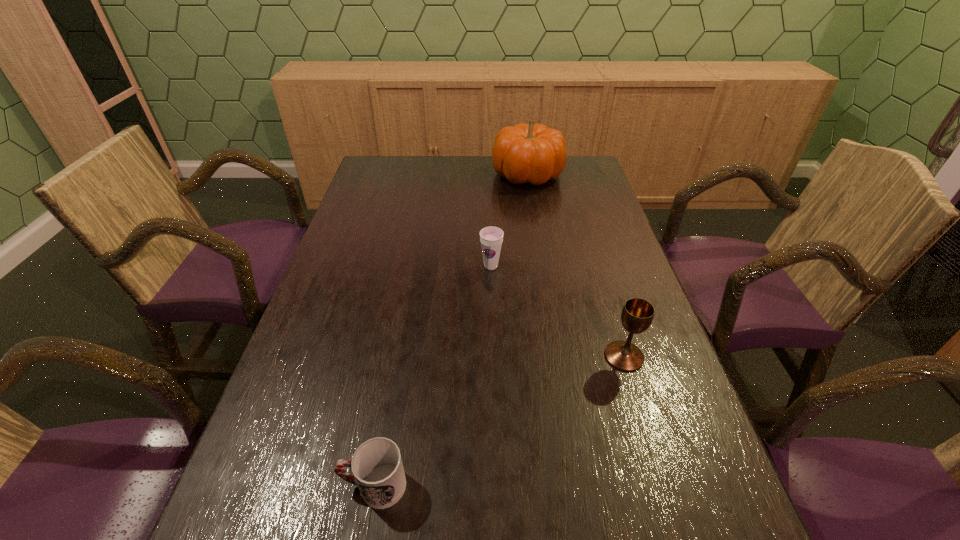
Where is `vacant space at the right edge of the desktop`? This screenshot has height=540, width=960. vacant space at the right edge of the desktop is located at coordinates (603, 240).

The width and height of the screenshot is (960, 540). Find the location of `free region at the far left corner`. free region at the far left corner is located at coordinates (382, 184).

Locate an element on the screen. free region at the far right corner is located at coordinates (552, 182).

At what (x,y) coordinates should I click in order to perform the action: click on free point between the second tallest object and the nearer cup. Please return your answer as a coordinate pair (x, y). This screenshot has height=540, width=960. Looking at the image, I should click on tap(499, 421).

What are the coordinates of `free spot between the pumpkin and the chalice` in the screenshot? It's located at (576, 265).

At what (x,y) coordinates should I click in order to perform the action: click on free spot between the tallest object and the nearest object. Please return your answer as a coordinate pair (x, y). The height and width of the screenshot is (540, 960). Looking at the image, I should click on (450, 330).

Locate an element on the screen. free space between the shortest object and the farther cup is located at coordinates (432, 376).

The width and height of the screenshot is (960, 540). Identify the location of vacant point located between the taller cup and the tallest object. (509, 220).

Locate an element on the screen. This screenshot has width=960, height=540. free space between the tallest object and the farther cup is located at coordinates [x=509, y=220].

Identify the location of empty space between the pumpkin and the second tallest object. (576, 265).